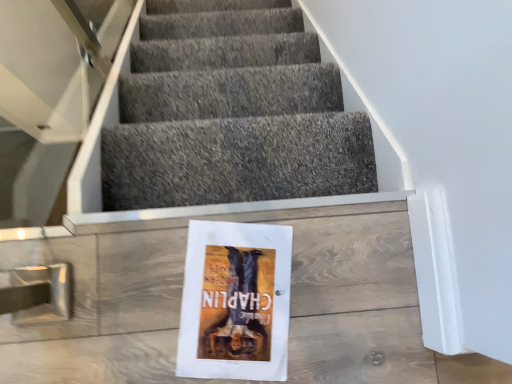
Locate an element on the screen. empty space that is ontop of white paper poster at lower center (from a real-world perspective) is located at coordinates (220, 325).